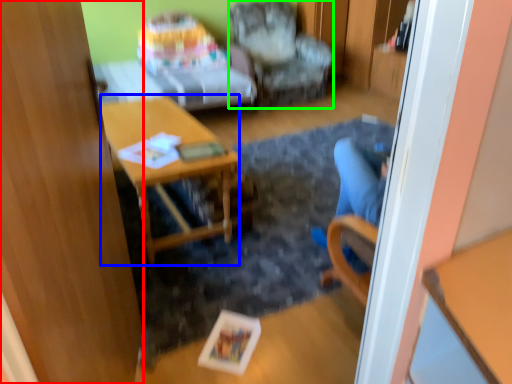
Question: Considering the real-world distances, which object is farthest from glass door (highlighted by a red box)? desk (highlighted by a blue box) or chair (highlighted by a green box)?

Choices:
 (A) desk
 (B) chair

Answer: (B)